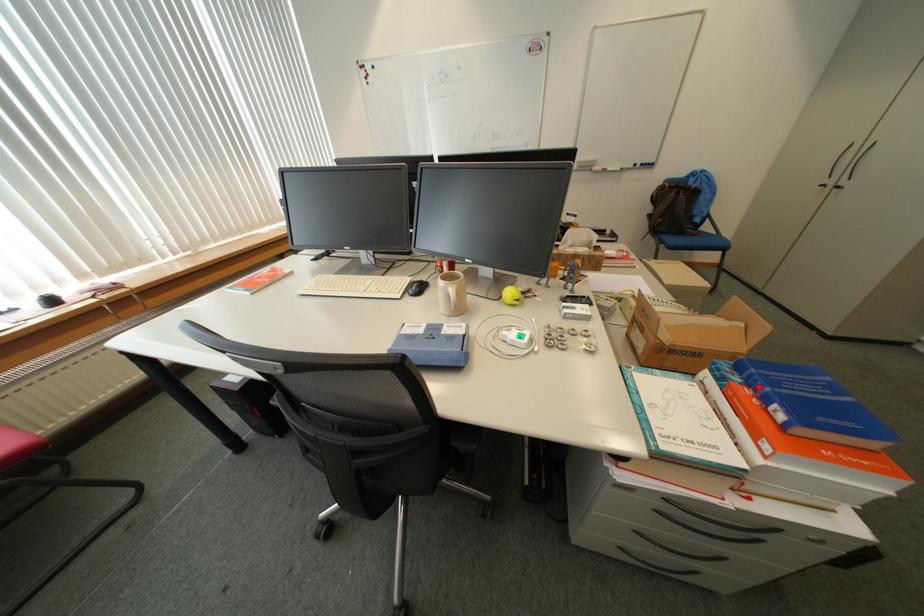
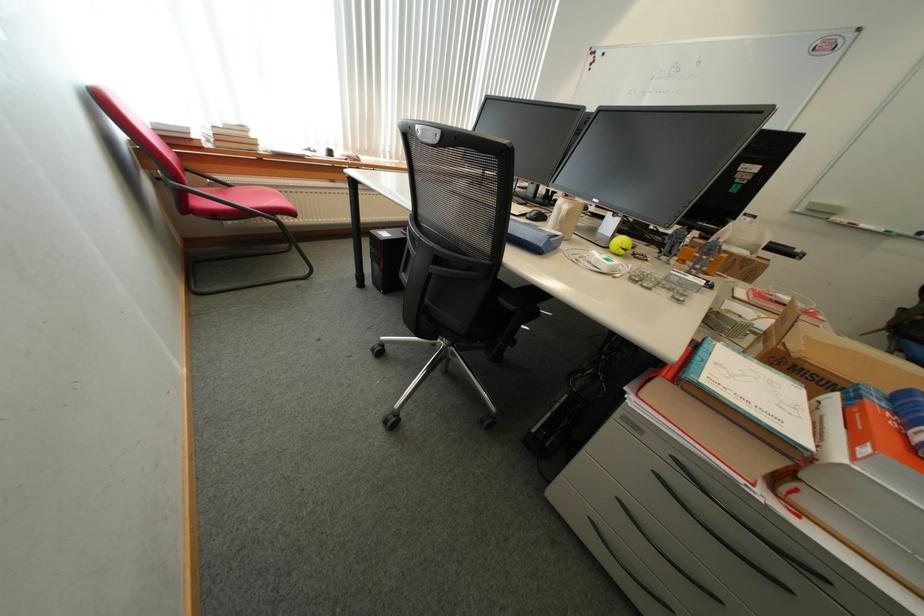
In the second image, find the point that corresponds to the highlighted location in the first image.

(906, 415)